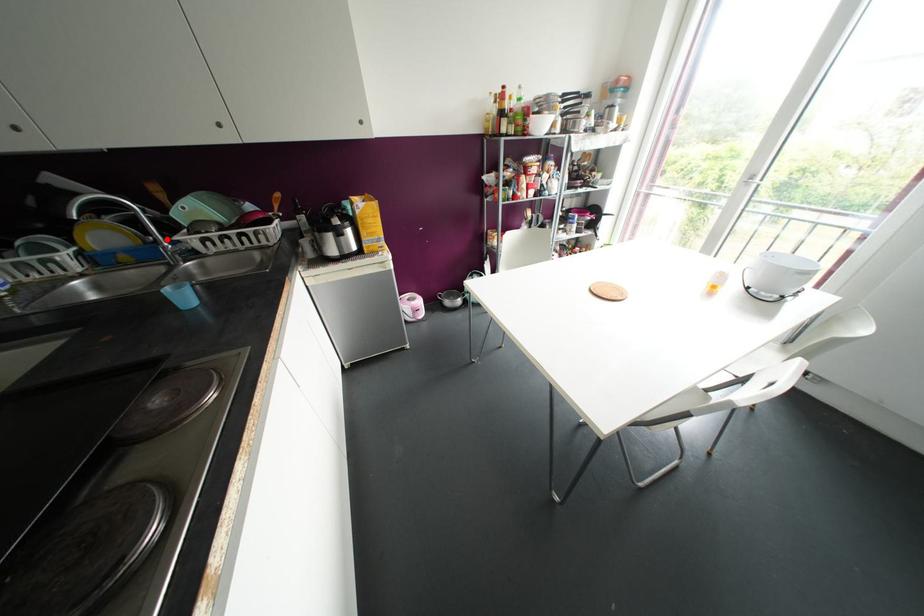
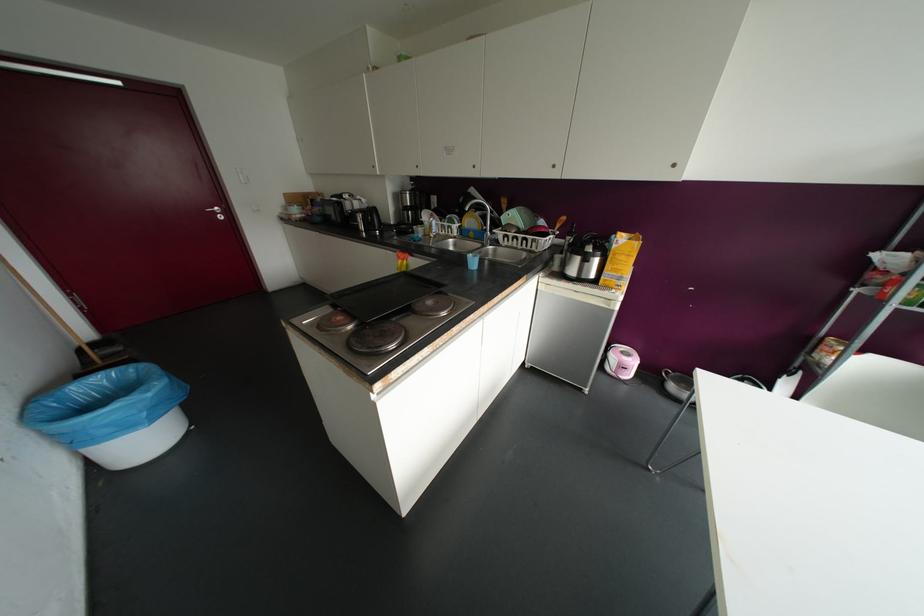
Question: I am providing you with two images of the same scene from different viewpoints. In image1, a red point is highlighted. Considering the same 3D point in image2, which of the following is correct?

Choices:
 (A) It is closer
 (B) It is farther

Answer: (A)